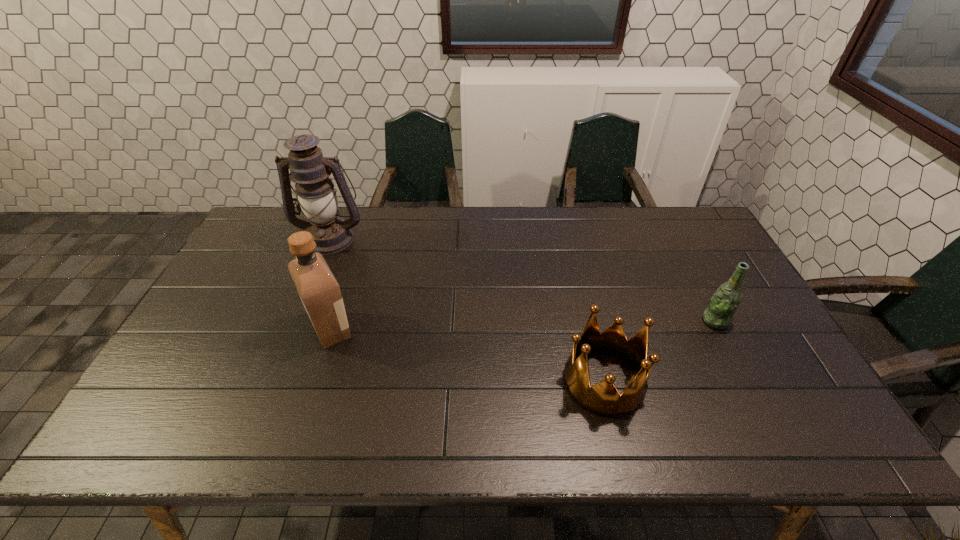
Image resolution: width=960 pixels, height=540 pixels. I want to click on free space between the liquor and the second object from right to left, so click(468, 355).

Image resolution: width=960 pixels, height=540 pixels. What are the coordinates of `free spot between the rightmost object and the oil lamp` in the screenshot? It's located at (523, 280).

The height and width of the screenshot is (540, 960). In order to click on vacant area between the third shortest object and the beer bottle in this screenshot , I will do `click(523, 325)`.

Locate an element on the screen. empty space between the third object from left to right and the second tallest object is located at coordinates (468, 355).

The image size is (960, 540). Identify the location of free space between the crown and the beer bottle. (660, 351).

Identify the location of free area in between the crown and the second tallest object. (468, 355).

Where is `free space between the second tallest object and the crown`? The height and width of the screenshot is (540, 960). free space between the second tallest object and the crown is located at coordinates tap(468, 355).

Locate which object is the closest to the farthest object. Please provide its 2D coordinates. Your answer should be formatted as a tuple, i.e. [(x, y)], where the tuple contains the x and y coordinates of a point satisfying the conditions above.

[(320, 293)]

Identify the location of object that is the second closest one to the rightmost object. (320, 293).

Where is `vacant position in the image that satisfies the following two spatial constraints: 1. on the front-facing side of the liquor; 2. on the left side of the crown`? vacant position in the image that satisfies the following two spatial constraints: 1. on the front-facing side of the liquor; 2. on the left side of the crown is located at coordinates (314, 381).